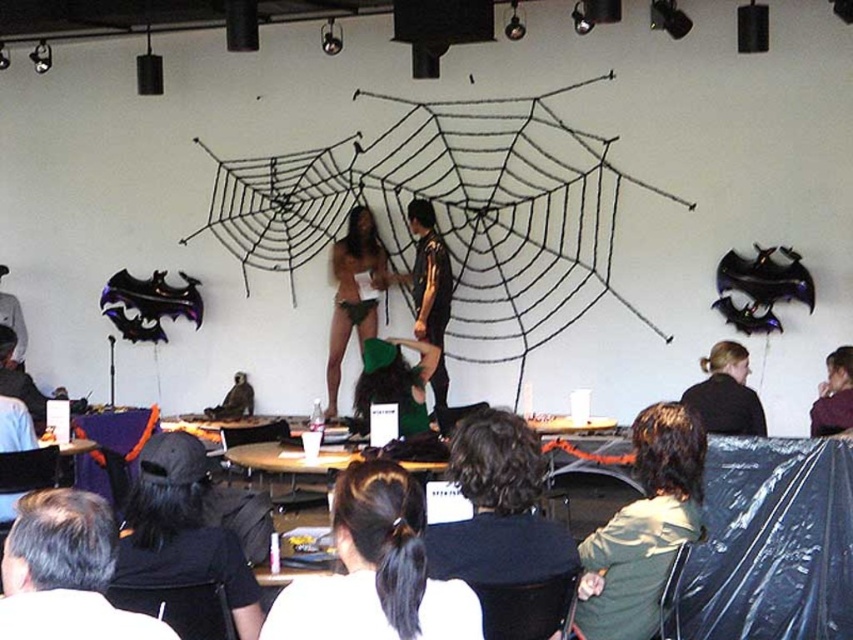
Question: Does green fabric jacket at lower right have a greater width compared to matte black shirt at lower right?

Choices:
 (A) yes
 (B) no

Answer: (A)

Question: Which point is farther to the camera?

Choices:
 (A) (409, 481)
 (B) (368, 298)

Answer: (B)

Question: Can you confirm if black matte jacket at upper right is smaller than matte black shirt at lower right?

Choices:
 (A) no
 (B) yes

Answer: (B)

Question: From the image, what is the correct spatial relationship of green matte bikini bottom at center in relation to matte black shirt at lower right?

Choices:
 (A) right
 (B) left

Answer: (B)

Question: Which point is closer to the camera?

Choices:
 (A) (721, 381)
 (B) (332, 384)
 (C) (830, 374)

Answer: (A)

Question: Which of the following is the farthest from the observer?

Choices:
 (A) green matte bikini bottom at center
 (B) matte black shirt at lower right
 (C) green fabric jacket at lower right

Answer: (A)